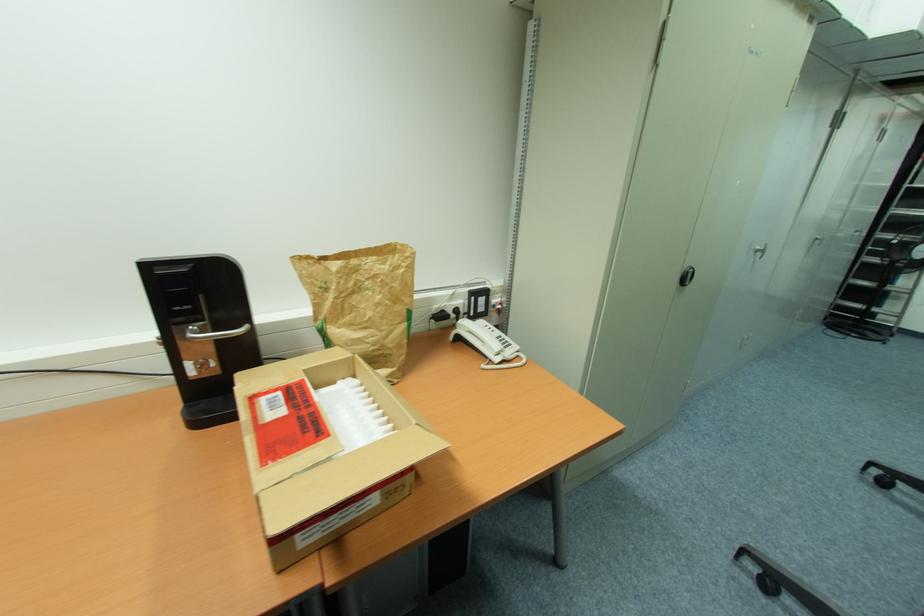
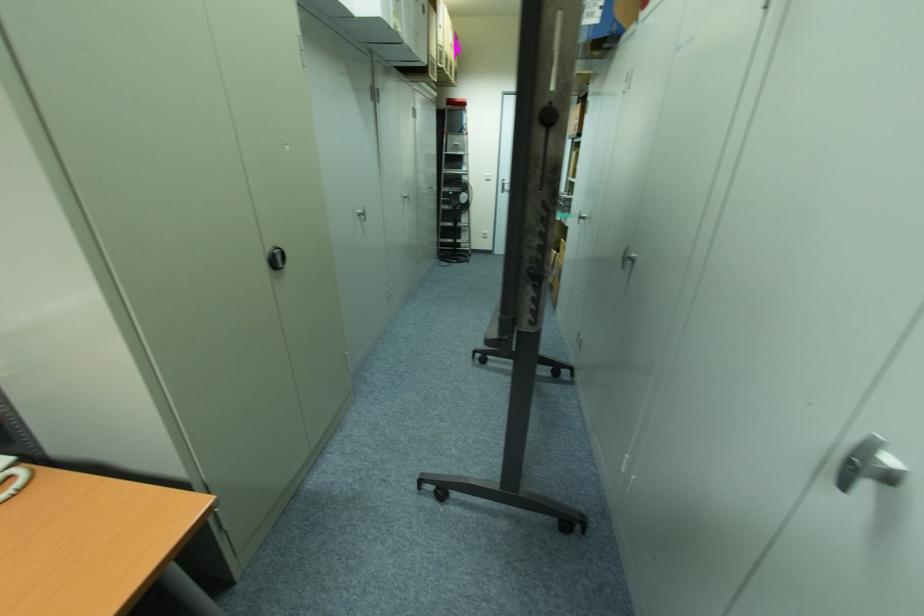
Where in the second image is the point corresponding to point (686, 280) from the first image?

(278, 262)